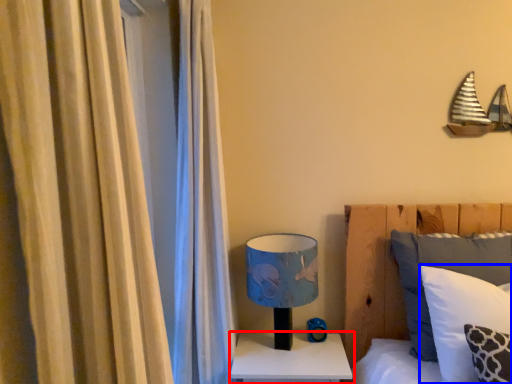
Question: Which object appears farthest to the camera in this image, nightstand (highlighted by a red box) or pillow (highlighted by a blue box)?

Choices:
 (A) nightstand
 (B) pillow

Answer: (A)